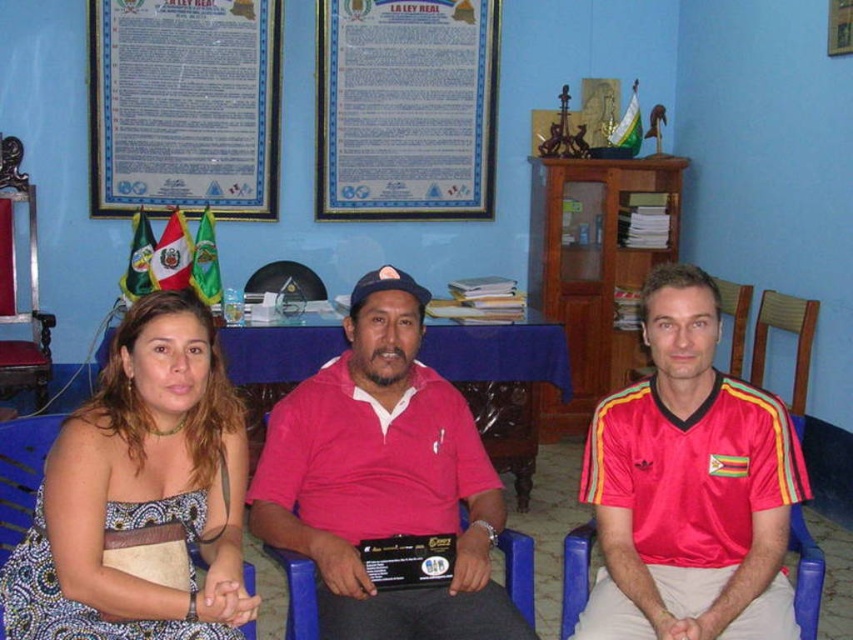
You are a photographer setting up for a photoshoot in the described scene. You need to position a light source between the printed fabric dress at center and the red shiny jersey at center. Given that the light source has a diameter of 30 centimeters, will it fit between them without overlapping either garment?

The distance between the printed fabric dress at center and the red shiny jersey at center is 97.87 centimeters. Since the light source has a diameter of 30 centimeters, there is sufficient space to place it between them without overlapping either garment.

You are an interior designer planning to place a new decorative item in the room. You have two options available for placement on the wall behind the printed fabric dress at center and the paperboard poster at upper center. Considering their sizes, which object requires a larger space on the wall?

The paperboard poster at upper center requires a larger space on the wall since it has a greater width than the printed fabric dress at center.

In the scene shown: You are standing in front of the image and want to know which of the two points, point (639, 608) or point (206, 198), is nearer to you. Can you determine this based on the scene?

Point (639, 608) is closer to the camera than point (206, 198), so it is nearer to you.